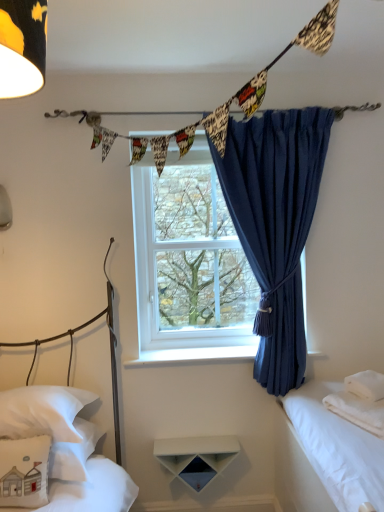
Question: Is white soft towel at right closer to the viewer compared to white soft pillow at right, which is the 3th pillow in left-to-right order?

Choices:
 (A) yes
 (B) no

Answer: (A)

Question: From the image's perspective, is white soft towel at right over white soft pillow at right, which is the first pillow in right-to-left order?

Choices:
 (A) yes
 (B) no

Answer: (B)

Question: Is white soft towel at right shorter than white soft pillow at right, which is the first pillow in right-to-left order?

Choices:
 (A) no
 (B) yes

Answer: (A)

Question: From the image's perspective, is white soft towel at right beneath white soft pillow at right, which is the 3th pillow in left-to-right order?

Choices:
 (A) no
 (B) yes

Answer: (B)

Question: Is white soft towel at right turned away from white soft pillow at right, which is the first pillow in right-to-left order?

Choices:
 (A) no
 (B) yes

Answer: (A)

Question: Choose the correct answer: Is white cotton bed at right, acting as the 3th bed starting from the left, inside white soft pillow at lower left, which is the second pillow from right to left, or outside it?

Choices:
 (A) outside
 (B) inside

Answer: (A)

Question: Is point (329, 467) closer or farther from the camera than point (64, 450)?

Choices:
 (A) farther
 (B) closer

Answer: (B)

Question: From the image's perspective, is white cotton bed at right, acting as the first bed starting from the right, above or below white soft pillow at lower left, which ranks as the 2th pillow in left-to-right order?

Choices:
 (A) above
 (B) below

Answer: (B)

Question: Based on their sizes in the image, would you say white cotton bed at right, acting as the 3th bed starting from the left, is bigger or smaller than white soft pillow at lower left, which is the second pillow from right to left?

Choices:
 (A) small
 (B) big

Answer: (B)

Question: Is clear glass window at center taller or shorter than white matte shelf at center?

Choices:
 (A) short
 (B) tall

Answer: (B)

Question: From the image's perspective, relative to white matte shelf at center, is clear glass window at center above or below?

Choices:
 (A) below
 (B) above

Answer: (B)

Question: Based on their positions, is clear glass window at center located to the left or right of white matte shelf at center?

Choices:
 (A) right
 (B) left

Answer: (A)

Question: Is clear glass window at center in front of or behind white matte shelf at center in the image?

Choices:
 (A) front
 (B) behind

Answer: (B)

Question: Is clear glass window at center situated inside white soft towel at right or outside?

Choices:
 (A) outside
 (B) inside

Answer: (A)

Question: Considering the positions of clear glass window at center and white soft towel at right in the image, is clear glass window at center wider or thinner than white soft towel at right?

Choices:
 (A) thin
 (B) wide

Answer: (A)